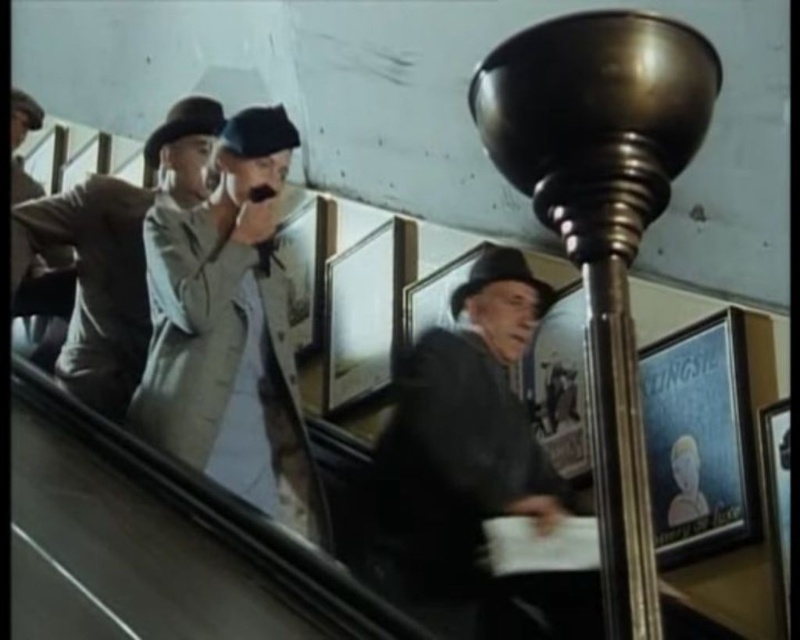
Looking at this image, you are a costume designer reviewing this scene. You need to determine which coat is positioned in front. Which one is closer to you between the dark gray wool coat at center and the light beige coat at left?

The dark gray wool coat at center is closer to the viewer than the light beige coat at left.

You are a character in the film scene and need to locate your dark gray wool coat at center. According to the coordinates provided, where should you look for it?

The dark gray wool coat at center is located at point (462, 456).